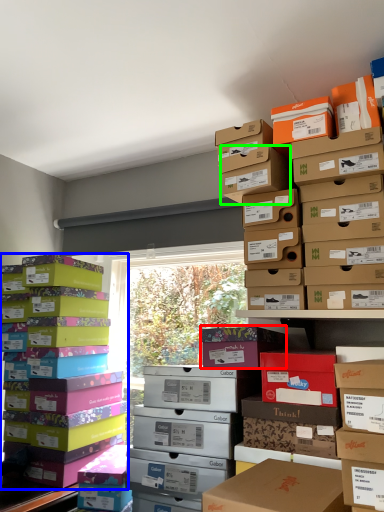
Question: Which object is the closest to the cardboard box (highlighted by a red box)? Choose among these: box (highlighted by a blue box) or storage box (highlighted by a green box).

Choices:
 (A) box
 (B) storage box

Answer: (B)